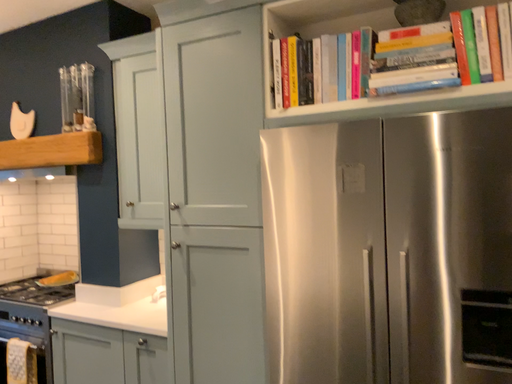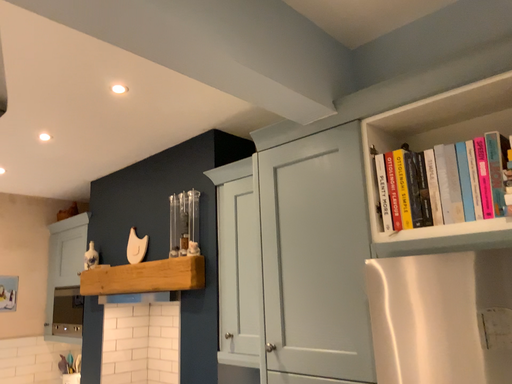
Question: How did the camera likely rotate when shooting the video?

Choices:
 (A) rotated downward
 (B) rotated upward

Answer: (B)